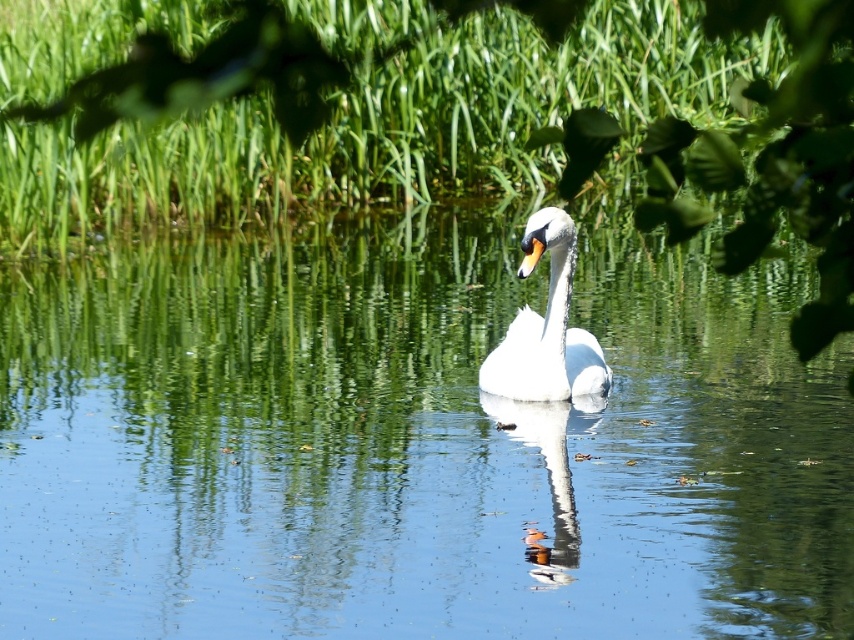
Question: Which point is farther from the camera taking this photo?

Choices:
 (A) (494, 362)
 (B) (673, 561)

Answer: (A)

Question: Can you confirm if clear water at center is positioned above white glossy swan at center?

Choices:
 (A) yes
 (B) no

Answer: (B)

Question: Does clear water at center have a smaller size compared to white glossy swan at center?

Choices:
 (A) no
 (B) yes

Answer: (B)

Question: Which object is closer to the camera taking this photo?

Choices:
 (A) clear water at center
 (B) white glossy swan at center

Answer: (B)

Question: Observing the image, what is the correct spatial positioning of clear water at center in reference to white glossy swan at center?

Choices:
 (A) below
 (B) above

Answer: (A)

Question: Which object appears farthest from the camera in this image?

Choices:
 (A) white glossy swan at center
 (B) clear water at center

Answer: (B)